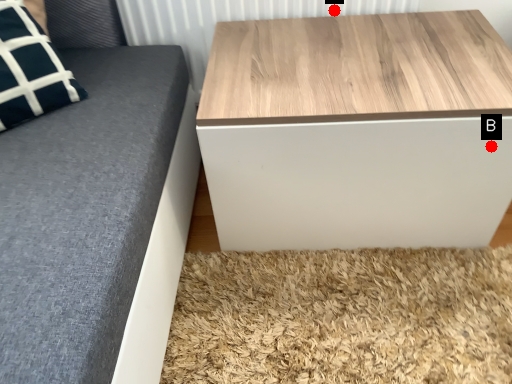
Question: Two points are circled on the image, labeled by A and B beside each circle. Among these points, which one is nearest to the camera?

Choices:
 (A) A is closer
 (B) B is closer

Answer: (B)